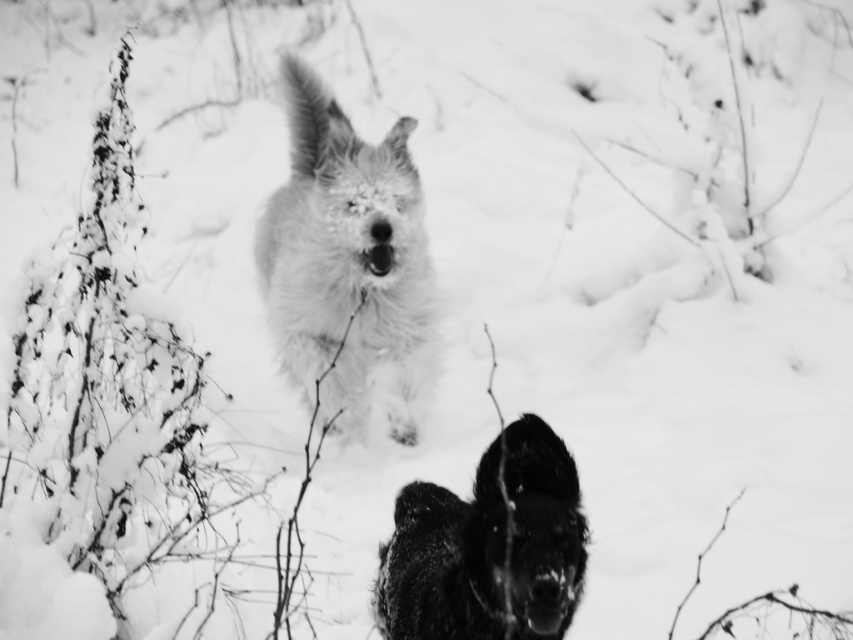
You are a photographer trying to capture both the fluffy white dog at center and the fuzzy black dog at center in a single frame. Given their sizes, which dog will appear larger in the photo?

The fluffy white dog at center will appear larger in the photo because it is bigger than the fuzzy black dog at center.

You are standing in the snowy scene and want to take a photo of the fuzzy black dog at center without the fluffy white dog at center blocking it. Is this possible?

The fuzzy black dog at center is behind the fluffy white dog at center, so you cannot take a photo of the fuzzy black dog at center without the fluffy white dog at center blocking it.

You are a photographer trying to capture both the fluffy white dog at center and the fuzzy black dog at center in a single frame. Based on their positions, which dog would appear wider in the photo?

The fluffy white dog at center might appear wider than fuzzy black dog at center according to the description.